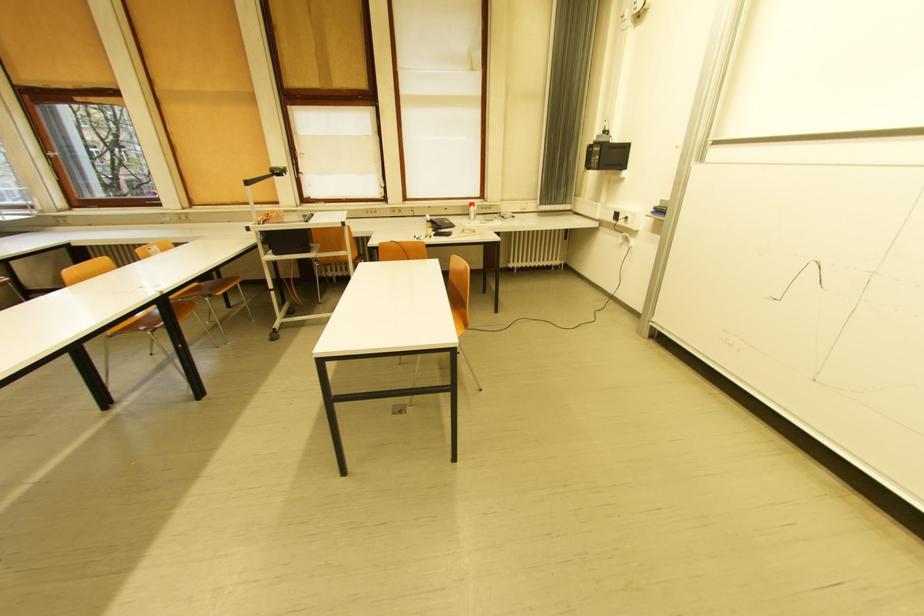
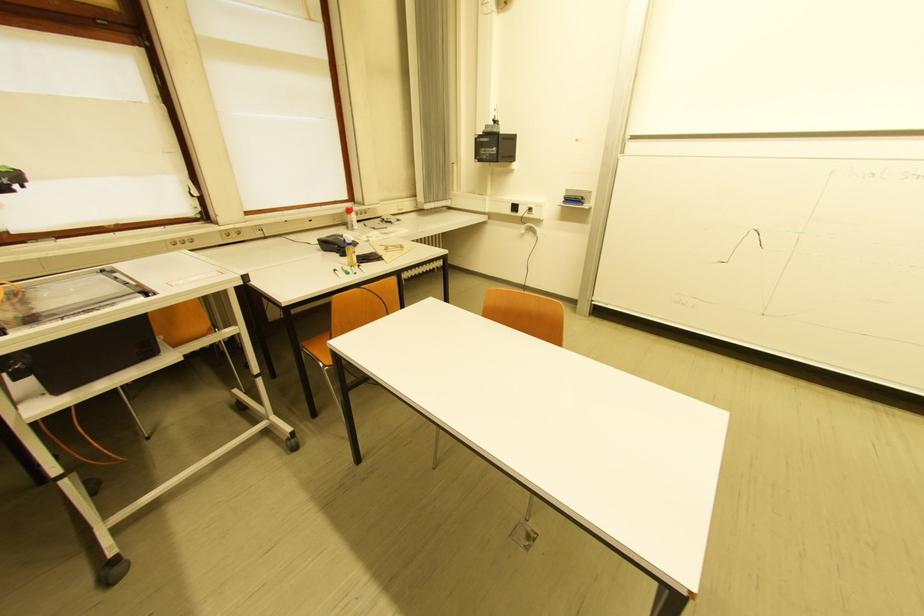
Question: I am providing you with two images of the same scene from different viewpoints. Which of the following objects are not visible in image2?

Choices:
 (A) red spray can
 (B) whiteboard eraser
 (C) marker pen
 (D) none of these

Answer: (D)